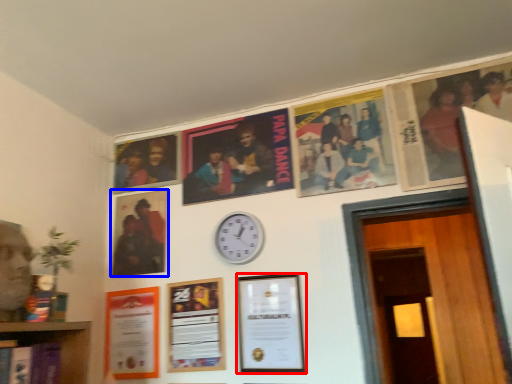
Question: Which object appears closest to the camera in this image, picture frame (highlighted by a red box) or picture frame (highlighted by a blue box)?

Choices:
 (A) picture frame
 (B) picture frame

Answer: (A)